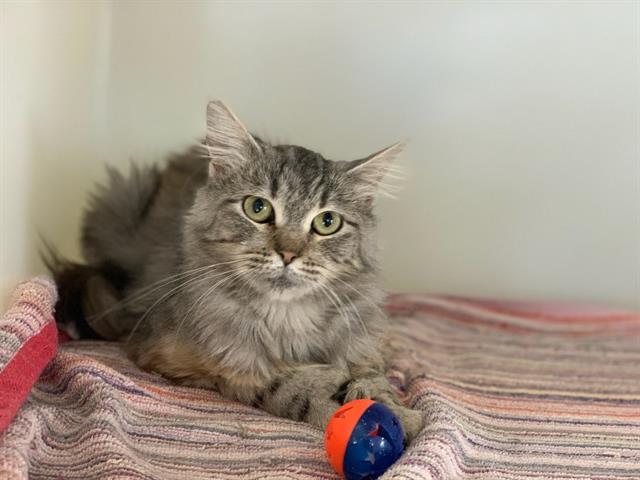
Where is `blanket`? The height and width of the screenshot is (480, 640). blanket is located at coordinates (486, 393).